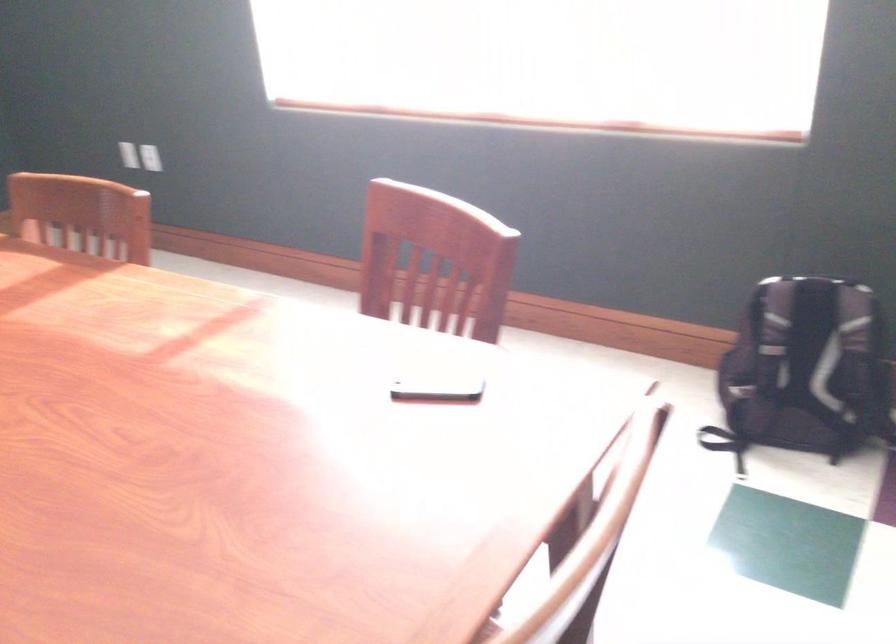
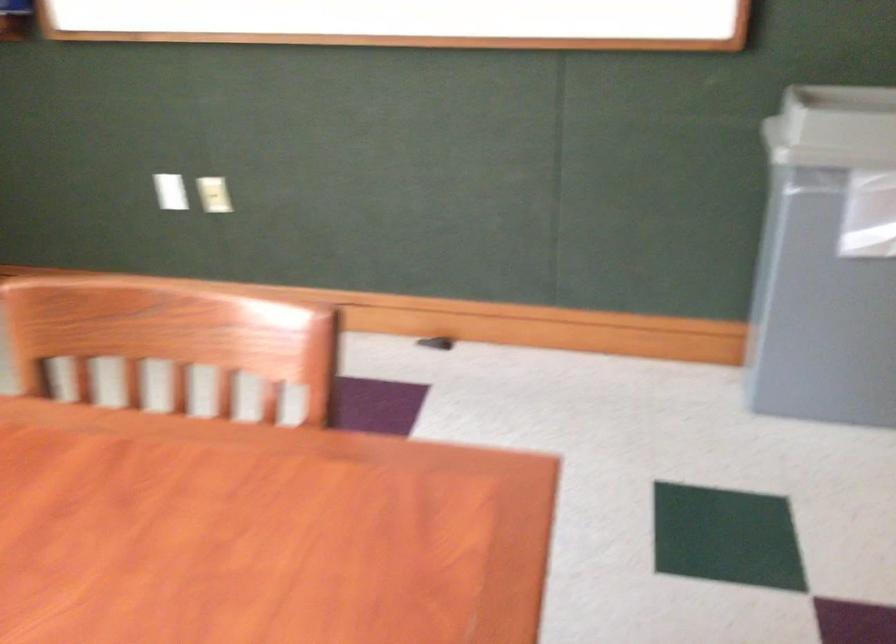
In the scene shown: The images are taken continuously from a first-person perspective. In which direction is your viewpoint rotating?

The rotation direction of the camera is right-down.